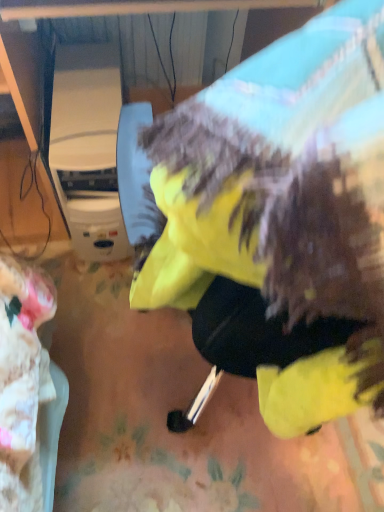
Question: Should I look upward or downward to see white plastic appliance at left?

Choices:
 (A) down
 (B) up

Answer: (B)